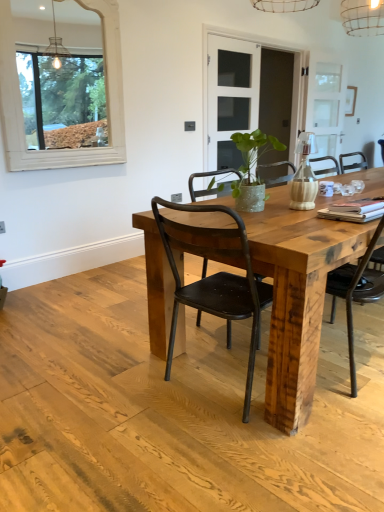
The width and height of the screenshot is (384, 512). In order to click on free region on the left part of matte white vase at center in this screenshot , I will do `click(268, 210)`.